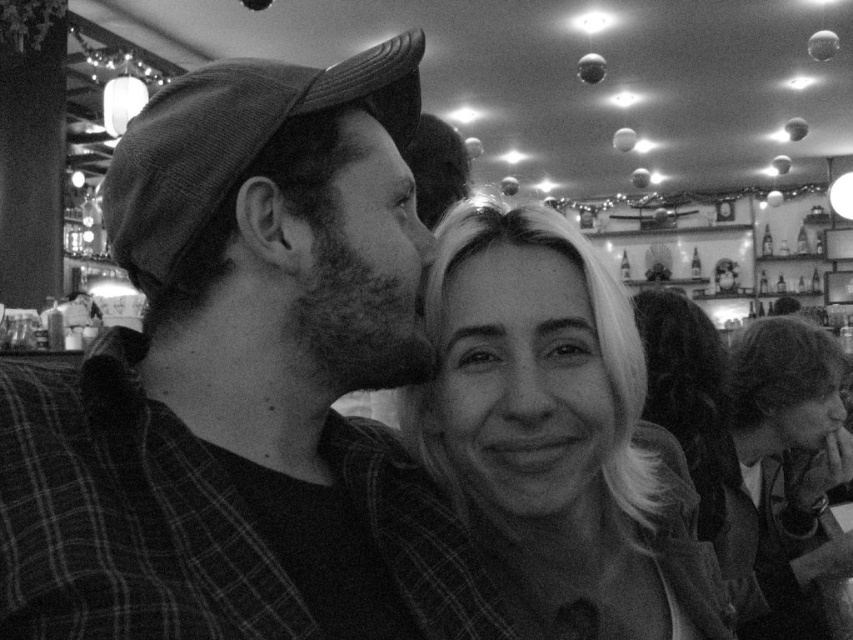
You are a photographer standing in the scene and want to take a clear photo of the plaid fabric shirt at left without any blur. The camera requires a subject to be at least 18 inches away to focus properly. Can you take the photo from your current position?

The plaid fabric shirt at left and viewer are 17.18 inches apart, which is less than the required 18 inches for proper focus. Therefore, you cannot take a clear photo of the plaid fabric shirt at left from your current position without blur.

You are taking a photo of the two people in the scene. You want to focus on the point closer to the camera. Which point should you choose between point [450,278] and point [450,262]?

Point [450,278] is further to the camera than point [450,262], so you should choose point [450,278] to focus on the closer point.

You are a photographer trying to capture the woman in the scene. You need to adjust your camera focus to ensure both the smooth blonde hair at center and the smooth skin at center are in sharp detail. Which object should you focus on first to ensure both are in focus, considering their positions?

The smooth blonde hair at center is positioned on the right side of smooth skin at center. To ensure both are in focus, you should focus on the smooth skin at center first, as it is closer to the camera, allowing the hair to fall within the depth of field.